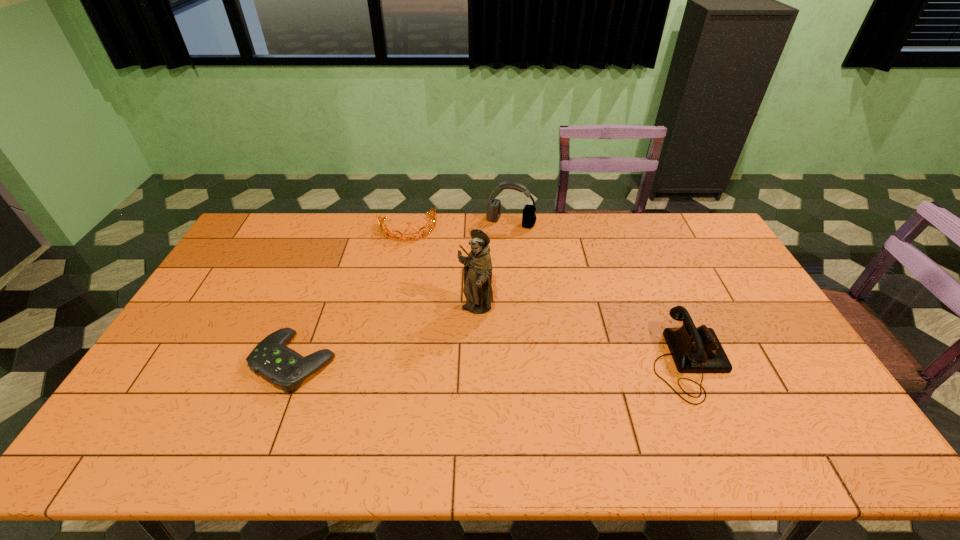
What are the coordinates of `vacant space on the desktop that is between the shortest object and the rightmost object and is positioned on the headband of the fourth shortest object` in the screenshot? It's located at (445, 362).

Locate an element on the screen. The height and width of the screenshot is (540, 960). vacant space on the desktop that is between the control and the third shortest object and is positioned on the front-facing side of the fourth tallest object is located at coordinates pyautogui.click(x=433, y=362).

The height and width of the screenshot is (540, 960). In order to click on vacant space on the desktop that is between the control and the rightmost object and is positioned on the front-facing side of the figurine in this screenshot , I will do (x=462, y=362).